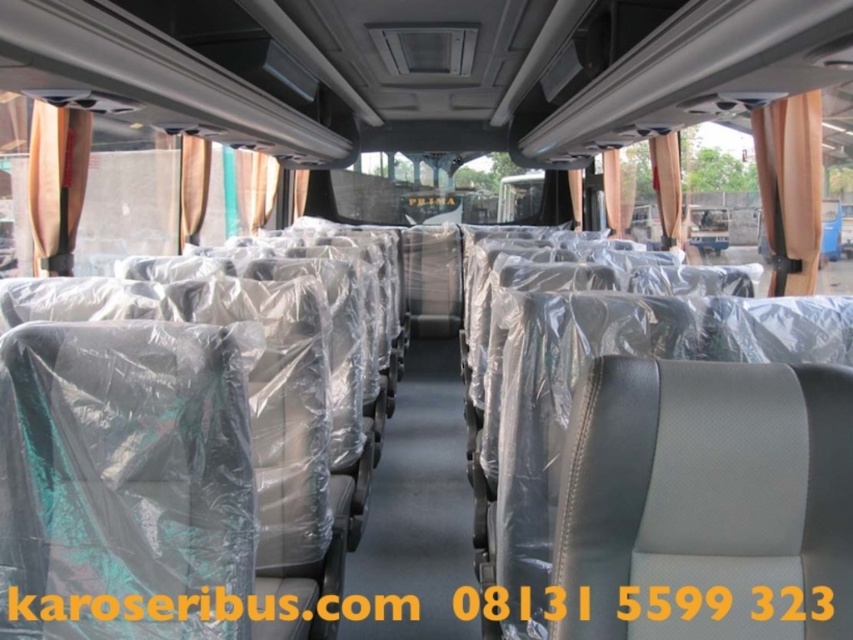
Question: Where is orange fabric curtain at upper right located in relation to metallic gold curtain at left in the image?

Choices:
 (A) above
 (B) below

Answer: (B)

Question: Is orange fabric curtain at upper right to the left of metallic gold curtain at left from the viewer's perspective?

Choices:
 (A) yes
 (B) no

Answer: (B)

Question: Is orange fabric curtain at upper right bigger than metallic gold curtain at left?

Choices:
 (A) yes
 (B) no

Answer: (A)

Question: Which point is closer to the camera taking this photo?

Choices:
 (A) (32, 212)
 (B) (763, 189)

Answer: (A)